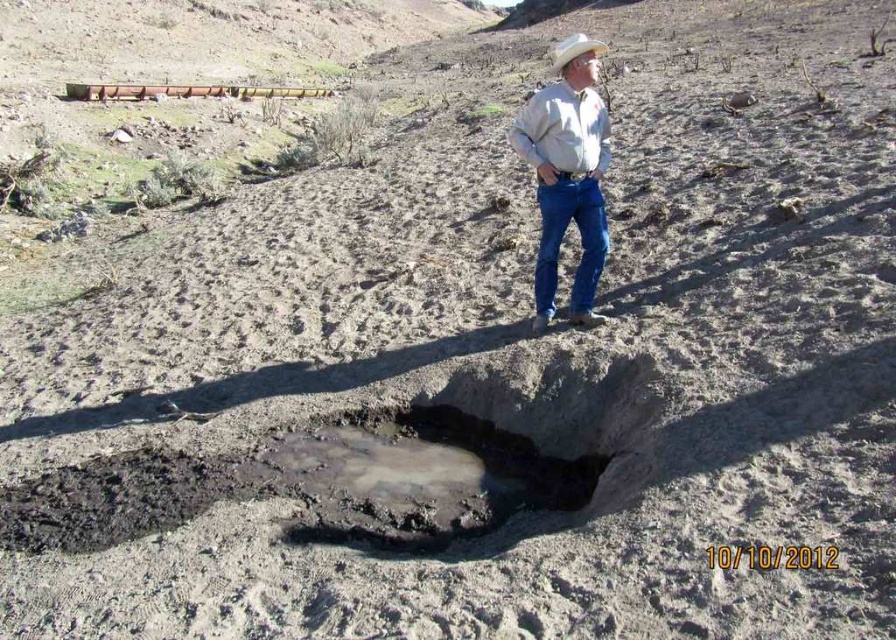
You are a geologist examining the muddy stone hole at center and the gray cotton shirt at upper right. Based on their positions, which object is closer to the observer?

The muddy stone hole at center is closer to the observer because it is positioned in front of the gray cotton shirt at upper right.

Consider the image. You are a hiker who has just arrived at the scene of a sinkhole. You need to place a gray cotton shirt at upper right at a specific location. Where exactly should you place it?

You should place the gray cotton shirt at upper right at point (567,173).

You are a surveyor standing at the center of the image. You need to locate the muddy stone hole at center. What are its coordinates?

The coordinates of the muddy stone hole at center are at point (470, 452).